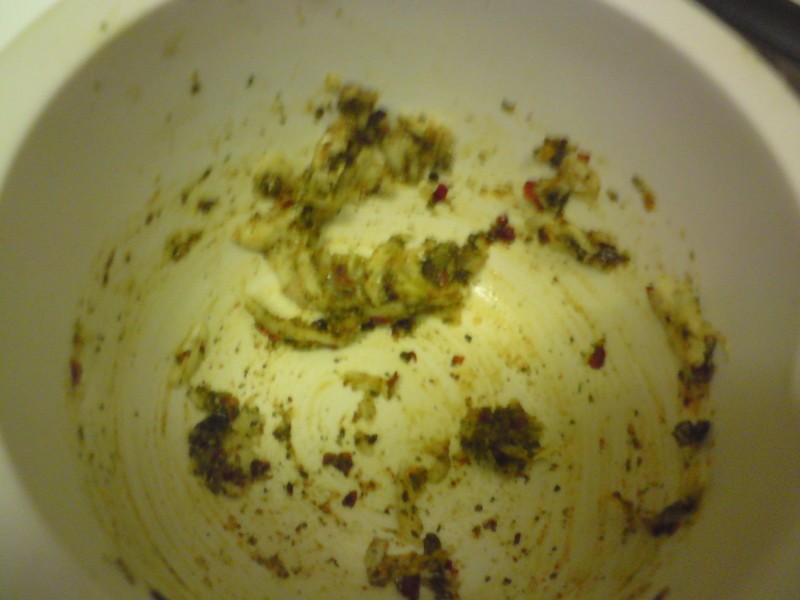
The width and height of the screenshot is (800, 600). I want to click on upper left side of bowls rim, so click(9, 45), click(46, 14).